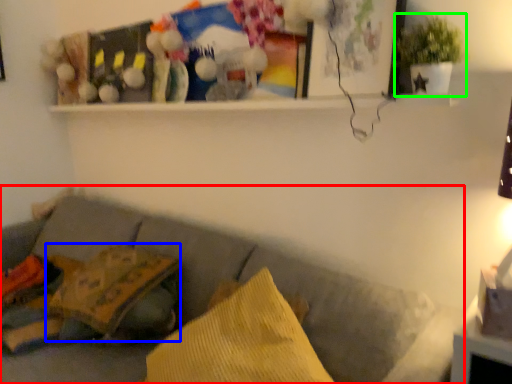
Question: Which object is positioned farthest from studio couch (highlighted by a red box)? Select from pillow (highlighted by a blue box) and houseplant (highlighted by a green box).

Choices:
 (A) pillow
 (B) houseplant

Answer: (B)